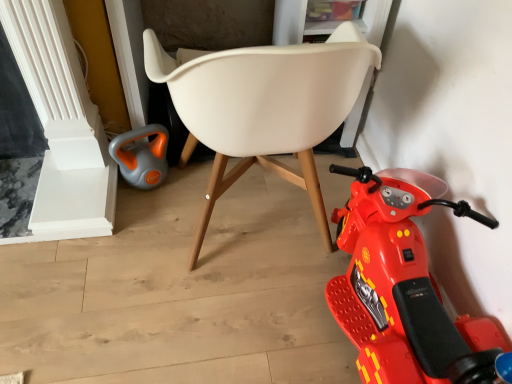
The width and height of the screenshot is (512, 384). I want to click on vacant area in front of white plastic chair at center, so click(215, 338).